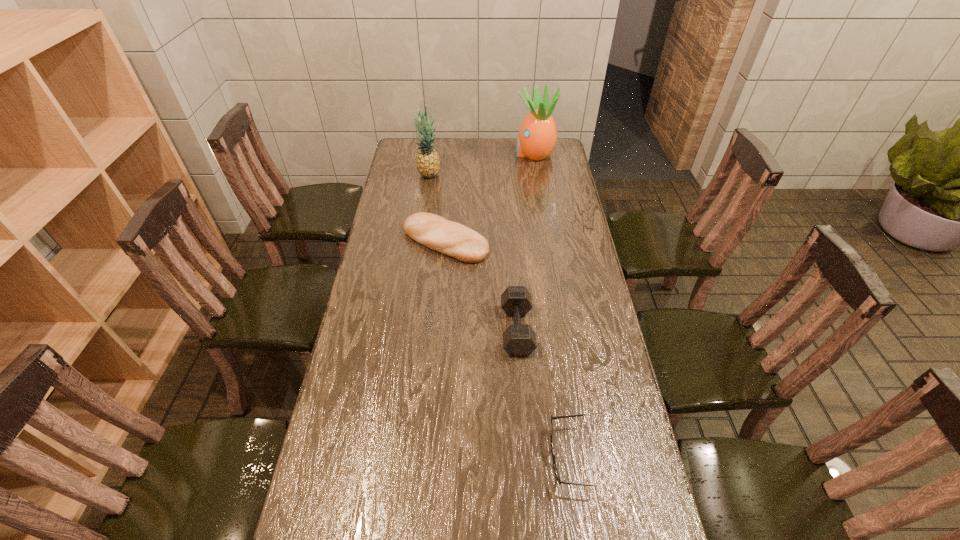
This screenshot has height=540, width=960. I want to click on vacant point located at the entrance of the farther pineapple, so click(445, 153).

Find the location of a particular element. Image resolution: width=960 pixels, height=540 pixels. vacant space positioned 0.170m on the front of the second farthest object is located at coordinates (424, 205).

Locate an element on the screen. The image size is (960, 540). vacant space located 0.250m on the front of the fourth farthest object is located at coordinates (525, 437).

This screenshot has height=540, width=960. I want to click on free location located on the front of the bread, so click(441, 298).

Where is `free location located 0.340m on the front-facing side of the spectacles`? free location located 0.340m on the front-facing side of the spectacles is located at coordinates (416, 457).

Image resolution: width=960 pixels, height=540 pixels. I want to click on free space located 0.110m on the front-facing side of the spectacles, so click(506, 457).

At what (x,y) coordinates should I click in order to perform the action: click on free space located 0.160m on the front-facing side of the spectacles. Please return your answer as a coordinate pair (x, y). Looking at the image, I should click on (486, 457).

The image size is (960, 540). In order to click on object located in the far edge section of the desktop in this screenshot , I will do `click(537, 137)`.

This screenshot has width=960, height=540. Find the location of `pineapple at the left edge`. pineapple at the left edge is located at coordinates (428, 163).

Locate an element on the screen. Image resolution: width=960 pixels, height=540 pixels. bread that is at the left edge is located at coordinates (450, 238).